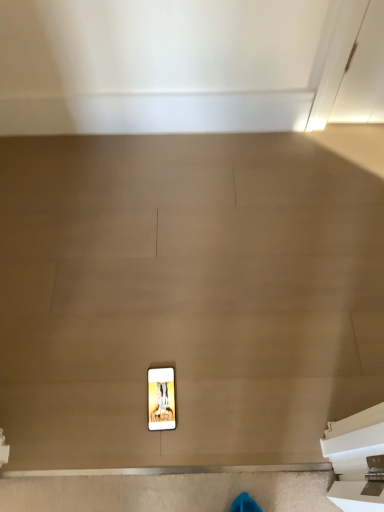
Describe the element at coordinates (161, 399) in the screenshot. The image size is (384, 512). I see `matte plastic picture frame at center` at that location.

Where is `matte plastic picture frame at center`? The image size is (384, 512). matte plastic picture frame at center is located at coordinates (161, 399).

Where is `matte plastic picture frame at center`? This screenshot has width=384, height=512. matte plastic picture frame at center is located at coordinates (161, 399).